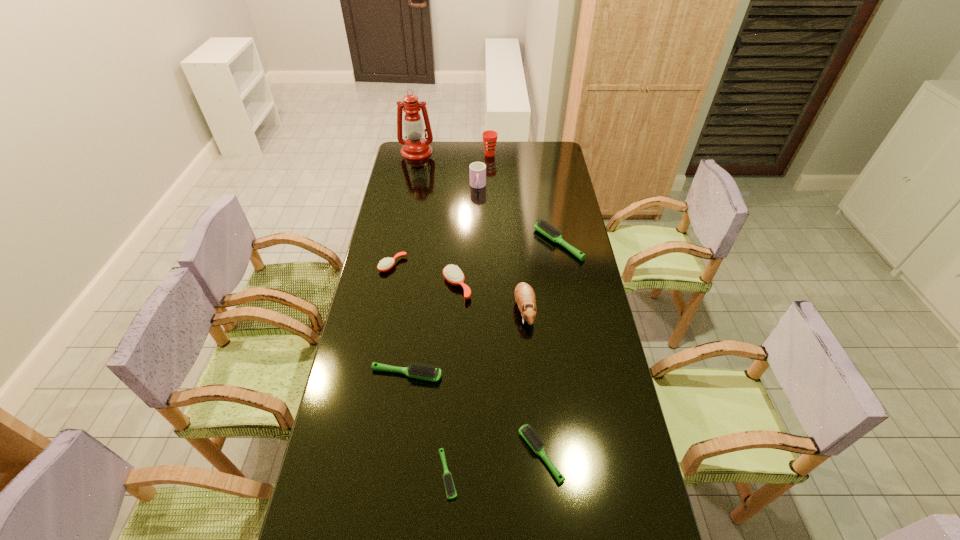
The width and height of the screenshot is (960, 540). I want to click on free spot between the brown hamster and the fourth farthest hairbrush, so click(466, 342).

I want to click on vacant area between the rightmost object and the right orange hairbrush, so click(x=508, y=265).

Find the location of a particular element. empty space that is in between the rightmost light hairbrush and the farther cup is located at coordinates (524, 199).

You are a GUI agent. You are given a task and a screenshot of the screen. Output one action in this format:
    pyautogui.click(x=<x>, y=<y>)
    Task: Click on the object that is the sixth nearest to the bigger orange hairbrush
    This screenshot has height=540, width=960.
    Given the screenshot: What is the action you would take?
    pyautogui.click(x=477, y=169)

This screenshot has width=960, height=540. In order to click on object that is the third closest to the leftmost light hairbrush in this screenshot , I will do `click(537, 445)`.

This screenshot has width=960, height=540. Identify the location of hairbrush that is the fourth closest to the fifth tallest hairbrush. (541, 226).

Locate which hairbrush ranks in proximity to the farther cup. Please provide its 2D coordinates. Your answer should be formatted as a tuple, i.e. [(x, y)], where the tuple contains the x and y coordinates of a point satisfying the conditions above.

[(541, 226)]

Find the location of `light hairbrush that stands as the third closest to the smaller orange hairbrush`. light hairbrush that stands as the third closest to the smaller orange hairbrush is located at coordinates (449, 486).

Image resolution: width=960 pixels, height=540 pixels. In order to click on light hairbrush that stands as the third closest to the second biggest light hairbrush in this screenshot , I will do `click(541, 226)`.

Where is `free location that satisfies the following two spatial constraints: 1. on the front side of the tallest object; 2. on the right side of the right orange hairbrush`? This screenshot has width=960, height=540. free location that satisfies the following two spatial constraints: 1. on the front side of the tallest object; 2. on the right side of the right orange hairbrush is located at coordinates (391, 286).